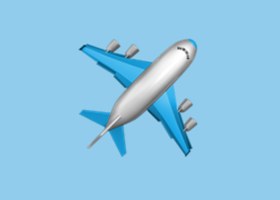
Image resolution: width=280 pixels, height=200 pixels. Find the location of `windows`. windows is located at coordinates (177, 48), (180, 48), (183, 49), (187, 52), (186, 55), (188, 58).